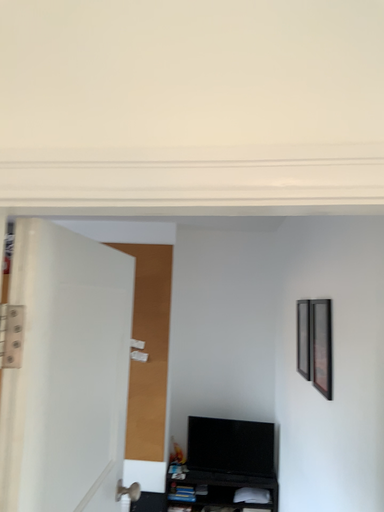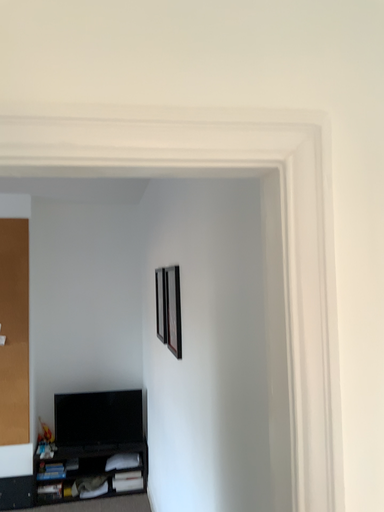
Question: Which way did the camera rotate in the video?

Choices:
 (A) rotated right
 (B) rotated left

Answer: (A)